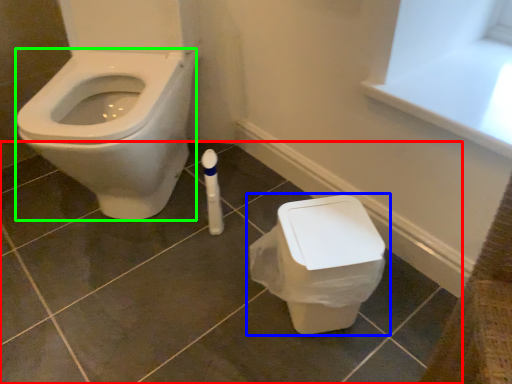
Question: Estimate the real-world distances between objects in this image. Which object is closer to tile (highlighted by a red box), toilet (highlighted by a blue box) or bidet (highlighted by a green box)?

Choices:
 (A) toilet
 (B) bidet

Answer: (A)